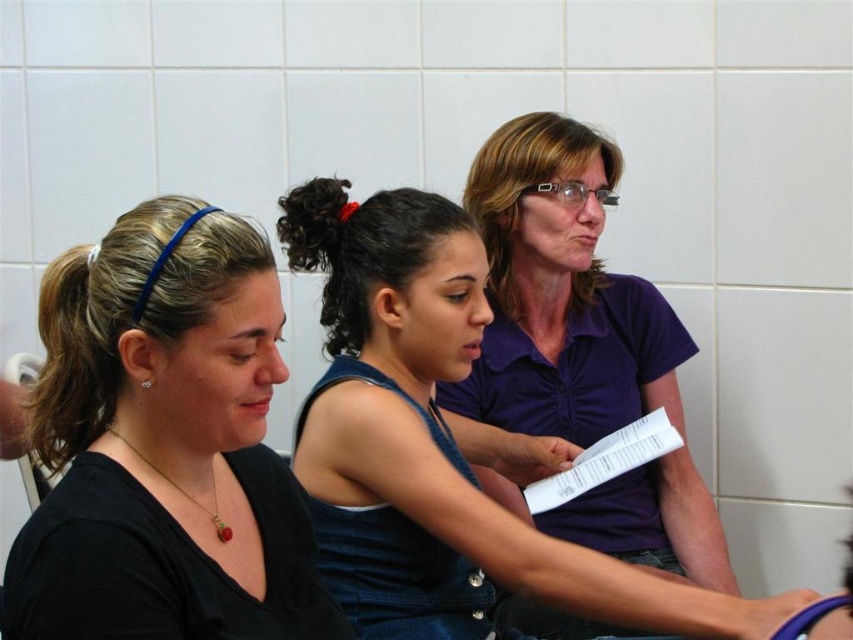
Question: Can you confirm if brown hair at left is positioned to the right of curly hair at center?

Choices:
 (A) no
 (B) yes

Answer: (A)

Question: Which of the following is the farthest from the observer?

Choices:
 (A) denim at center
 (B) white paper at center

Answer: (B)

Question: Can you confirm if denim at center is positioned to the right of white paper at center?

Choices:
 (A) yes
 (B) no

Answer: (B)

Question: Is curly hair at center positioned at the back of white paper at center?

Choices:
 (A) yes
 (B) no

Answer: (B)

Question: Which of the following is the closest to the observer?

Choices:
 (A) brown hair at left
 (B) denim at center
 (C) black matte shirt at center
 (D) curly hair at center

Answer: (C)

Question: Which point appears farthest from the camera in this image?

Choices:
 (A) (358, 376)
 (B) (113, 396)

Answer: (A)